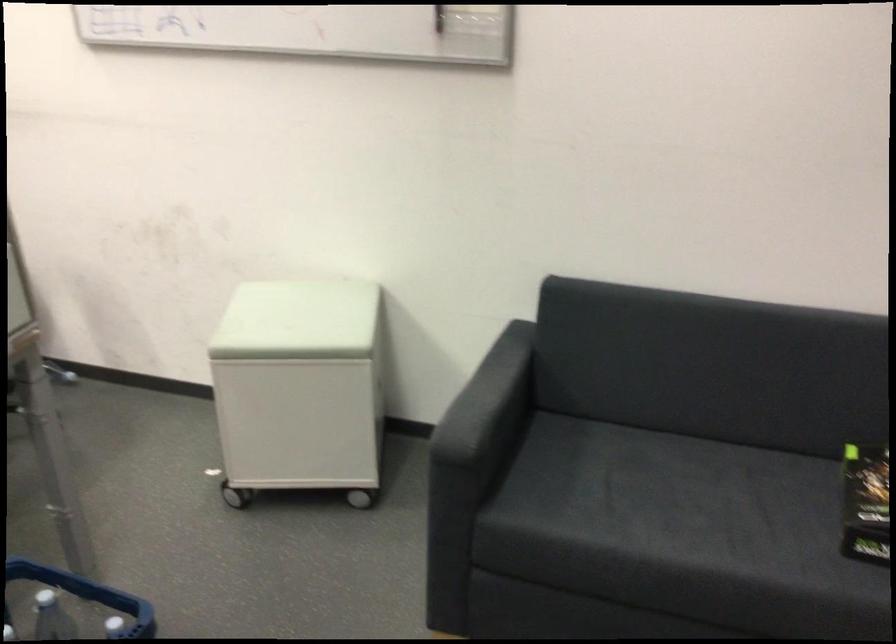
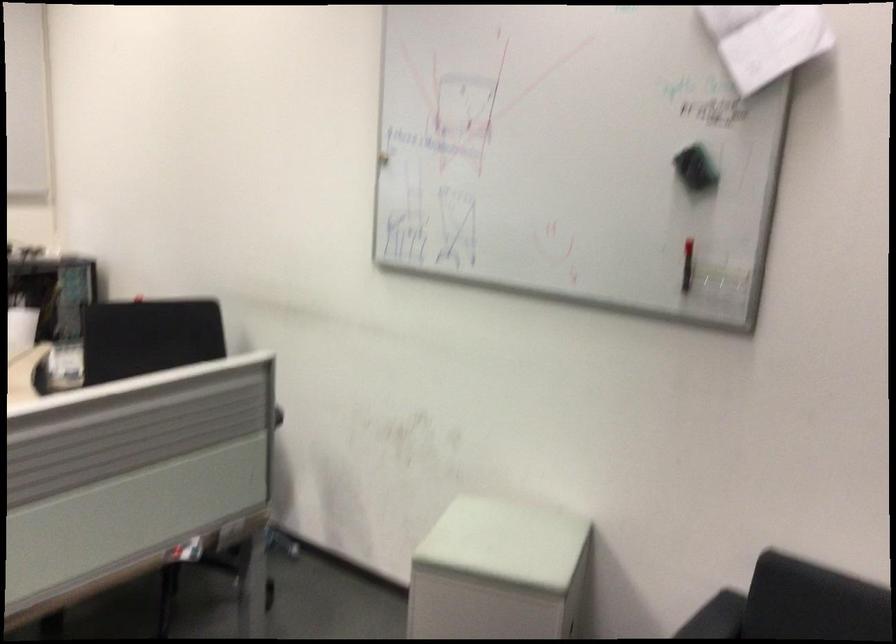
In a continuous first-person perspective shot, in which direction is the camera moving?

The movement direction of the cameraman is right, backward.